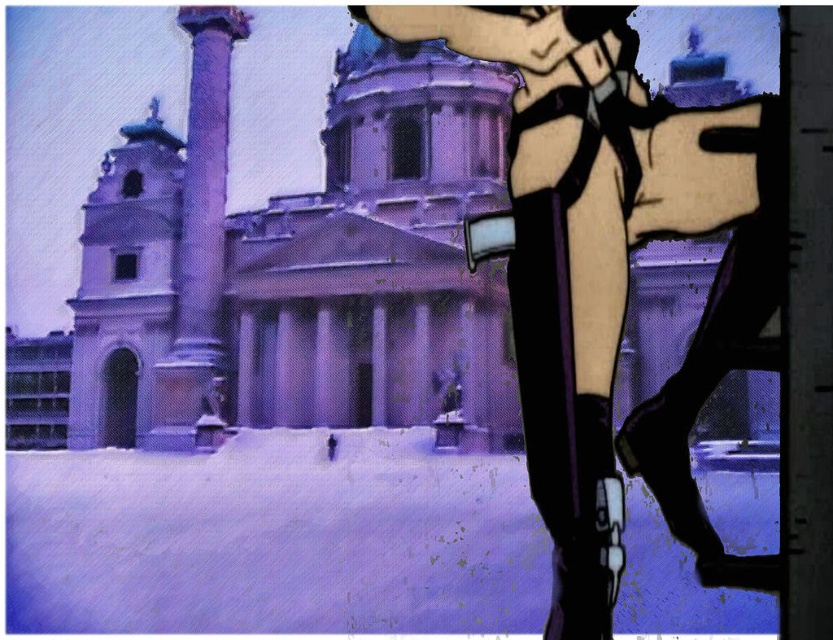
Is smooth beige shorts at right shorter than smooth stone column at center-left?

Correct, smooth beige shorts at right is not as tall as smooth stone column at center-left.

Is point (681, 200) positioned before point (177, 444)?

Yes, it is.

The image size is (833, 640). What are the coordinates of `smooth beige shorts at right` in the screenshot? It's located at (612, 273).

At what (x,y) coordinates should I click in order to perform the action: click on smooth beige shorts at right. Please return your answer as a coordinate pair (x, y). The width and height of the screenshot is (833, 640). Looking at the image, I should click on (612, 273).